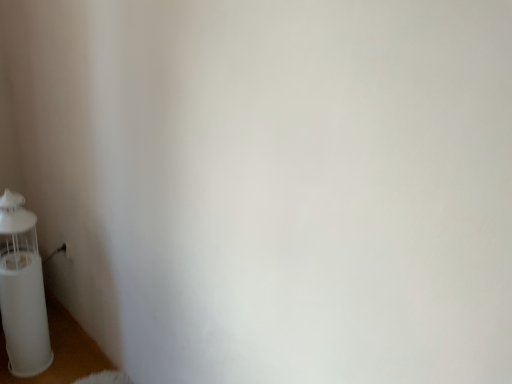
At what (x,y) coordinates should I click in order to perform the action: click on white plastic bottle at lower left. Please return your answer as a coordinate pair (x, y). The image size is (512, 384). Looking at the image, I should click on (22, 290).

Describe the element at coordinates (22, 290) in the screenshot. The width and height of the screenshot is (512, 384). I see `white plastic bottle at lower left` at that location.

You are a GUI agent. You are given a task and a screenshot of the screen. Output one action in this format:
    pyautogui.click(x=<x>, y=<y>)
    Task: Click on the white plastic bottle at lower left
    The width and height of the screenshot is (512, 384).
    Given the screenshot: What is the action you would take?
    pyautogui.click(x=22, y=290)